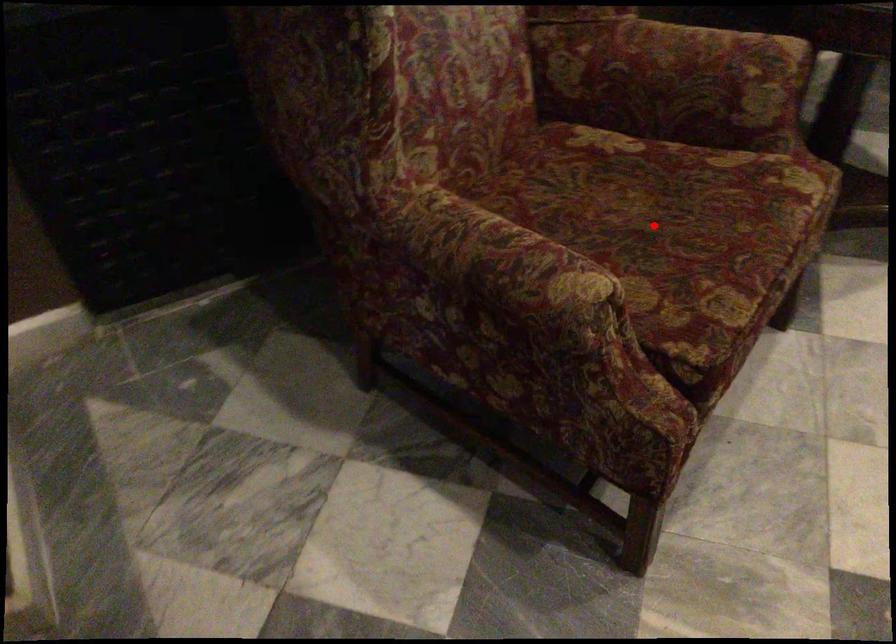
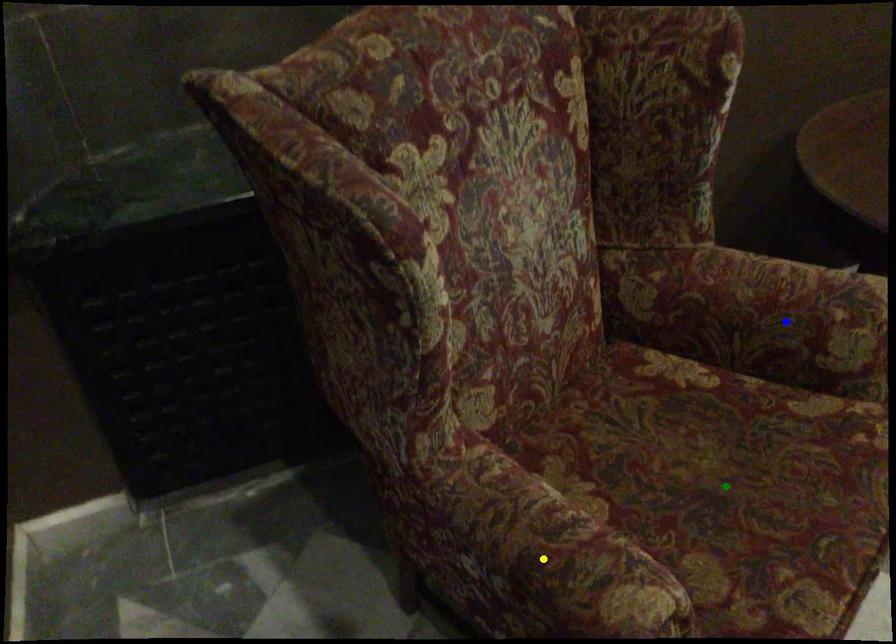
Question: I am providing you with two images of the same scene from different viewpoints. A red point is marked on the first image. You are given multiple points on the second image. Can you choose the point in image 2 that corresponds to the point in image 1?

Choices:
 (A) yellow point
 (B) blue point
 (C) green point

Answer: (C)